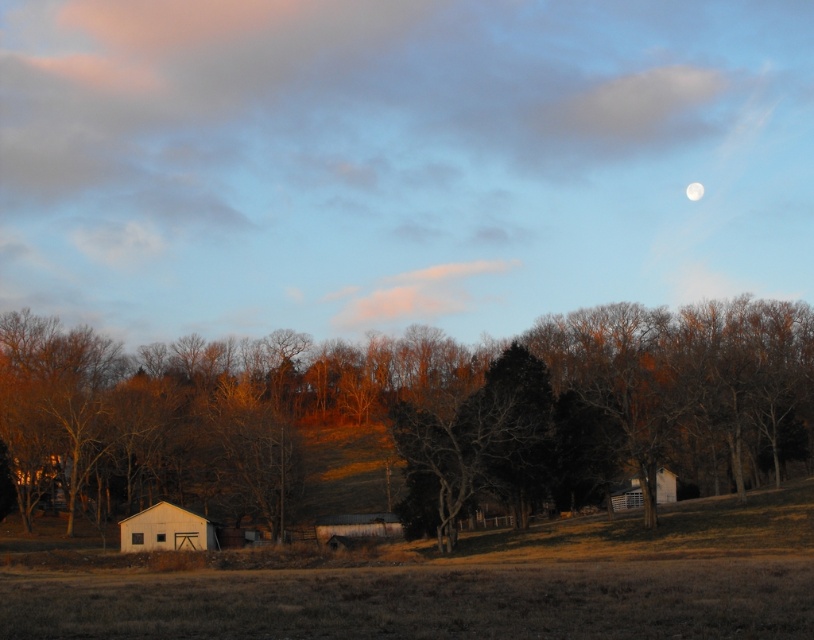
Question: Which point is farther from the camera taking this photo?

Choices:
 (A) (212, 529)
 (B) (675, 483)

Answer: (B)

Question: Can you confirm if brown matte tree at center is positioned below white matte barn at lower left?

Choices:
 (A) no
 (B) yes

Answer: (A)

Question: Which point is farther from the camera taking this photo?

Choices:
 (A) (143, 520)
 (B) (348, 540)
 (C) (699, 182)
 (D) (55, 429)

Answer: (C)

Question: Which point is closer to the camera taking this photo?

Choices:
 (A) (353, 536)
 (B) (690, 188)
 (C) (163, 508)
 (D) (20, 362)

Answer: (C)

Question: From the image, what is the correct spatial relationship of brown matte tree at center in relation to white smooth moon at upper right?

Choices:
 (A) left
 (B) right

Answer: (A)

Question: Is rustic wooden barn at center bigger than white wooden barn at lower right?

Choices:
 (A) yes
 (B) no

Answer: (B)